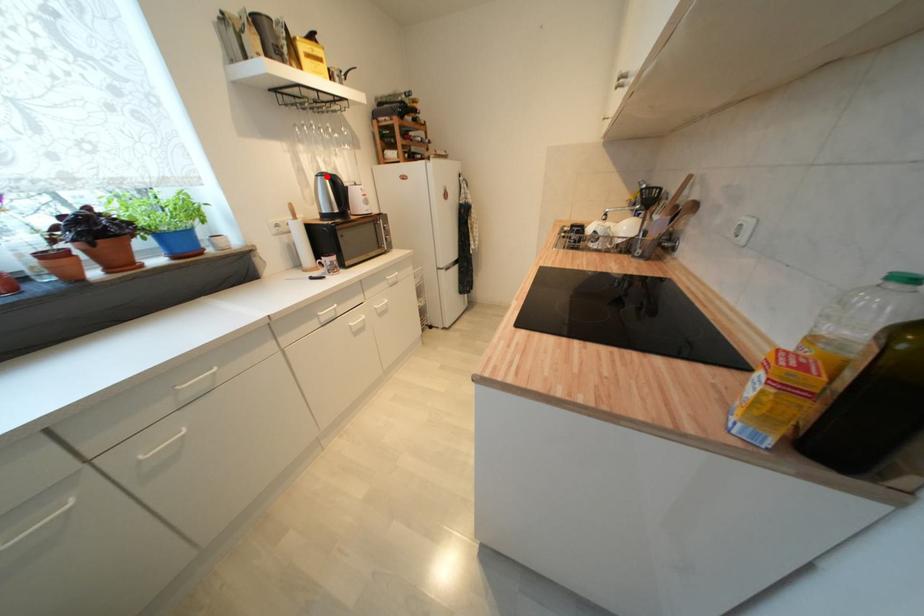
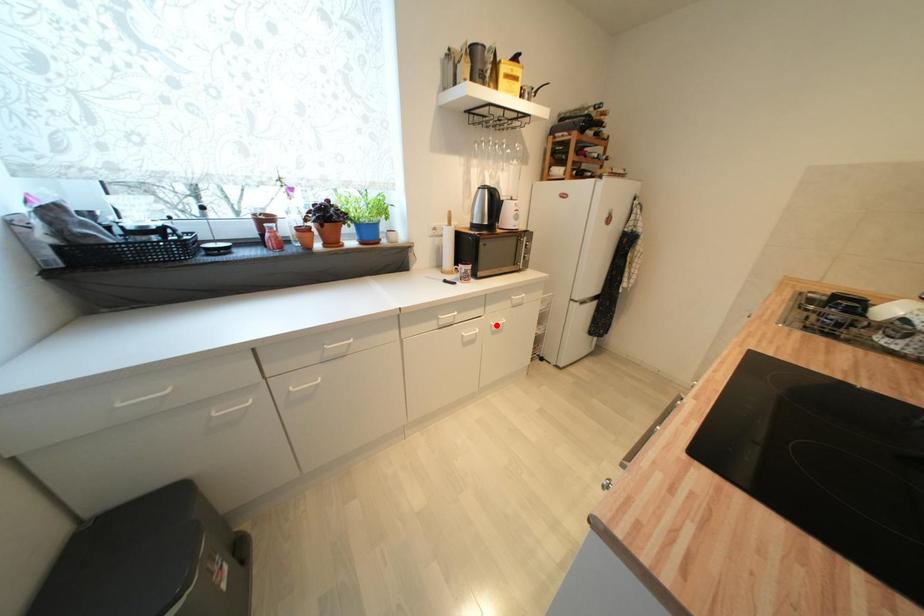
I am providing you with two images of the same scene from different viewpoints. A red point is marked on the first image and another point is marked on the second image. Are the points marked in image1 and image2 representing the same 3D position?

No